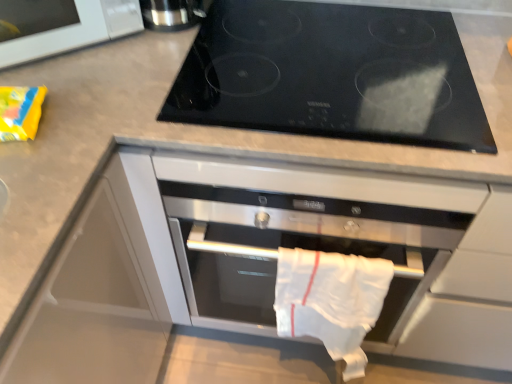
Question: Is the depth of black glass cooktop at upper center greater than that of satin silver thermos at upper left?

Choices:
 (A) no
 (B) yes

Answer: (A)

Question: Is black glass cooktop at upper center directly adjacent to satin silver thermos at upper left?

Choices:
 (A) yes
 (B) no

Answer: (B)

Question: Could you tell me if black glass cooktop at upper center is facing satin silver thermos at upper left?

Choices:
 (A) no
 (B) yes

Answer: (A)

Question: Considering the relative sizes of black glass cooktop at upper center and satin silver thermos at upper left in the image provided, is black glass cooktop at upper center shorter than satin silver thermos at upper left?

Choices:
 (A) yes
 (B) no

Answer: (A)

Question: Is black glass cooktop at upper center bigger than satin silver thermos at upper left?

Choices:
 (A) no
 (B) yes

Answer: (B)

Question: From a real-world perspective, is white cotton towel at center physically located above or below black glass cooktop at upper center?

Choices:
 (A) above
 (B) below

Answer: (B)

Question: In terms of height, does white cotton towel at center look taller or shorter compared to black glass cooktop at upper center?

Choices:
 (A) tall
 (B) short

Answer: (A)

Question: Is white cotton towel at center bigger or smaller than black glass cooktop at upper center?

Choices:
 (A) big
 (B) small

Answer: (B)

Question: Relative to black glass cooktop at upper center, is white cotton towel at center in front or behind?

Choices:
 (A) behind
 (B) front

Answer: (A)

Question: Is white glossy microwave at upper left to the left or to the right of white cotton towel at center in the image?

Choices:
 (A) right
 (B) left

Answer: (B)

Question: Considering their positions, is white glossy microwave at upper left located in front of or behind white cotton towel at center?

Choices:
 (A) front
 (B) behind

Answer: (A)

Question: From their relative heights in the image, would you say white glossy microwave at upper left is taller or shorter than white cotton towel at center?

Choices:
 (A) short
 (B) tall

Answer: (A)

Question: From a real-world perspective, is white glossy microwave at upper left above or below white cotton towel at center?

Choices:
 (A) above
 (B) below

Answer: (A)

Question: Considering their positions, is black glass cooktop at upper center located in front of or behind satin silver thermos at upper left?

Choices:
 (A) behind
 (B) front

Answer: (B)

Question: Is point (445, 72) positioned closer to the camera than point (204, 4)?

Choices:
 (A) closer
 (B) farther

Answer: (A)